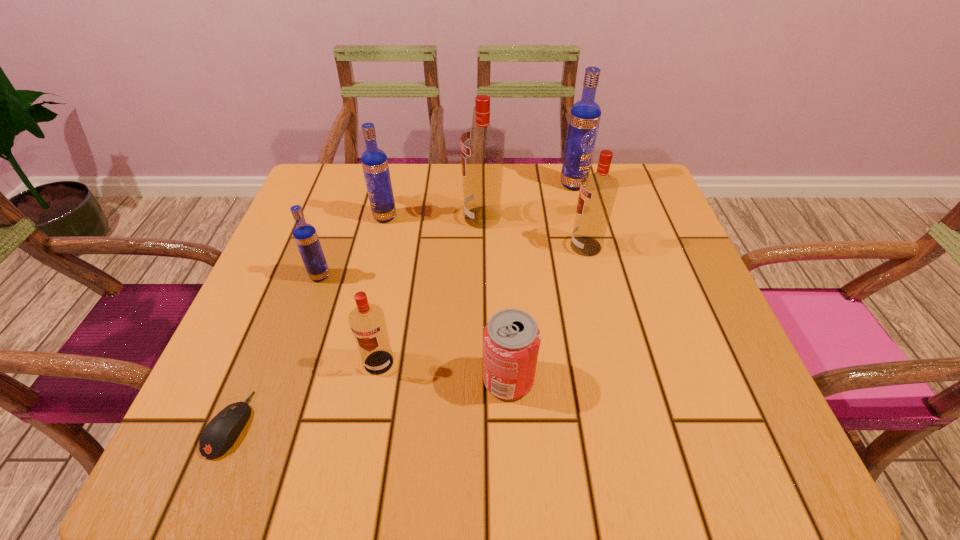
At what (x,y) coordinates should I click in order to perform the action: click on vacant space in between the leftmost vodka and the rightmost red vodka. Please return your answer as a coordinate pair (x, y). Looking at the image, I should click on pos(453,261).

Image resolution: width=960 pixels, height=540 pixels. I want to click on vacant space that is in between the second smallest blue vodka and the nearest vodka, so click(382, 289).

Find the location of a particular element. The width and height of the screenshot is (960, 540). empty space between the second biggest blue vodka and the leftmost vodka is located at coordinates (352, 246).

Find the location of a particular element. Image resolution: width=960 pixels, height=540 pixels. empty space that is in between the second nearest blue vodka and the seventh object from right to left is located at coordinates (352, 246).

Where is `free point between the farthest red vodka and the nearest blue vodka`? The height and width of the screenshot is (540, 960). free point between the farthest red vodka and the nearest blue vodka is located at coordinates (401, 247).

Identify the location of blank region between the second blue vodka from left to right and the fourth farthest vodka. This screenshot has width=960, height=540. (486, 232).

Where is `free spot between the fourth farthest vodka and the computer mouse`? free spot between the fourth farthest vodka and the computer mouse is located at coordinates (408, 335).

At what (x,y) coordinates should I click in order to perform the action: click on object that can be found as the third closest to the second farthest blue vodka. Please return your answer as a coordinate pair (x, y). The image size is (960, 540). Looking at the image, I should click on (367, 321).

Choose which object is the third nearest neighbor to the second shortest object. Please provide its 2D coordinates. Your answer should be formatted as a tuple, i.e. [(x, y)], where the tuple contains the x and y coordinates of a point satisfying the conditions above.

[(482, 146)]

Identify the location of vodka that stands as the third closest to the farthest red vodka. tap(584, 119).